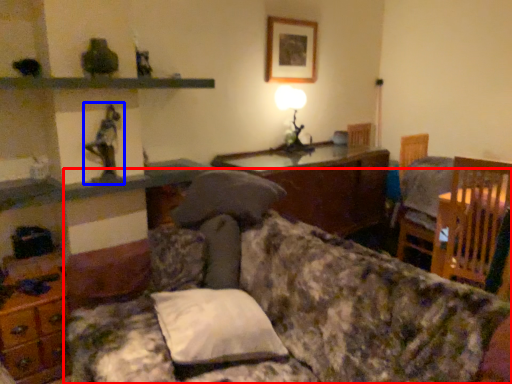
Question: Which object is closer to the camera taking this photo, studio couch (highlighted by a red box) or toy (highlighted by a blue box)?

Choices:
 (A) studio couch
 (B) toy

Answer: (A)